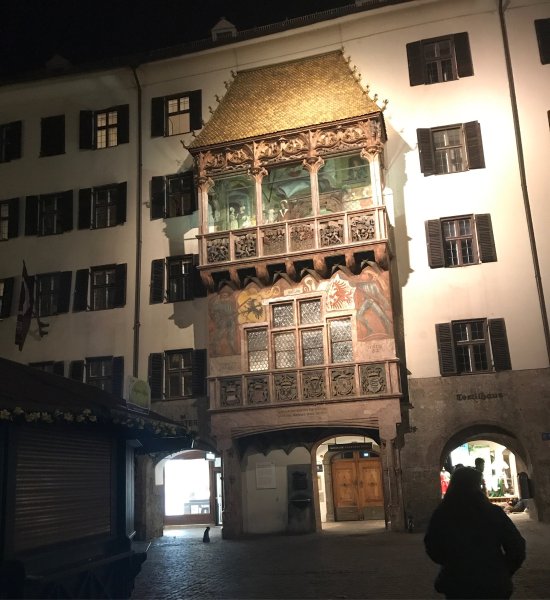
Identify the location of archways. The width and height of the screenshot is (550, 600). (181, 452), (341, 436), (482, 431).